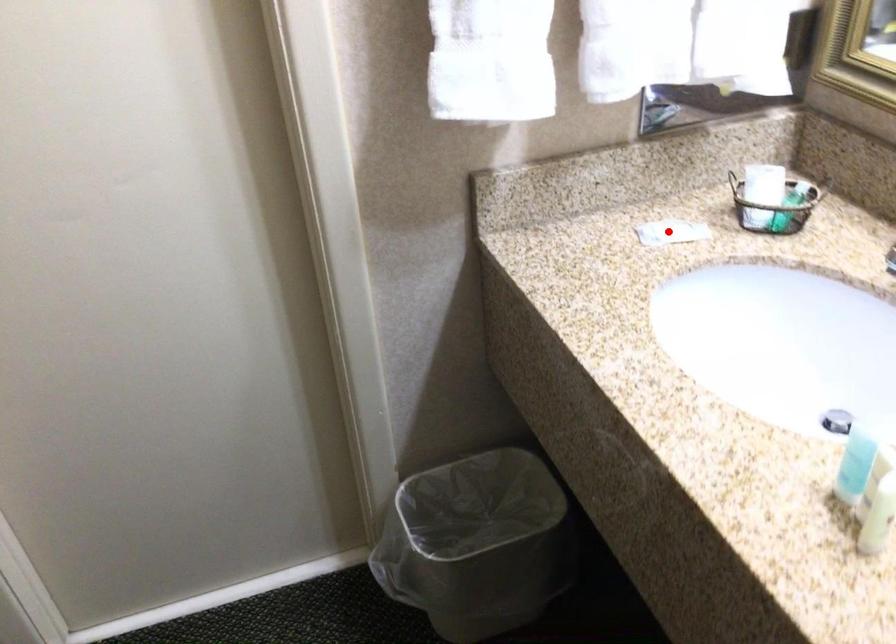
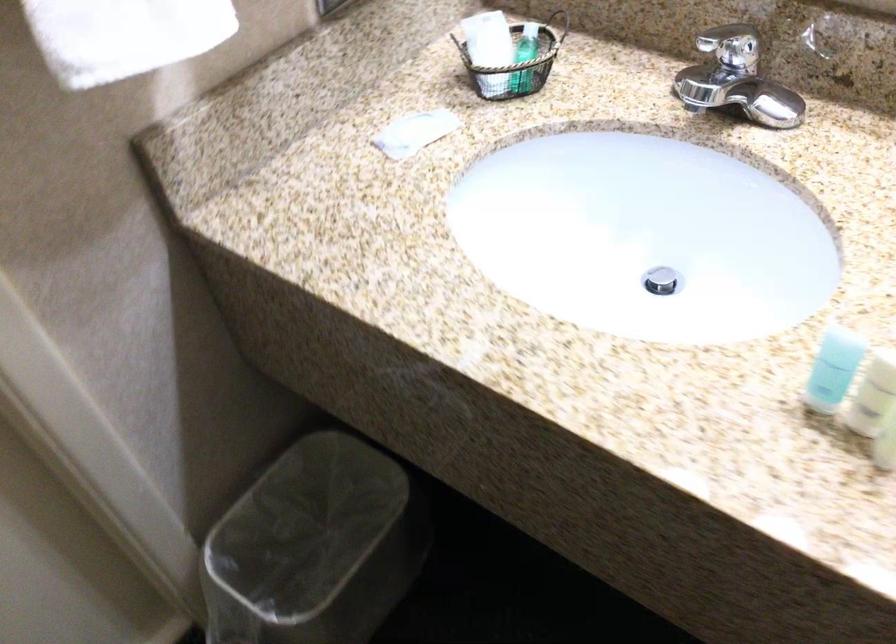
Locate, in the second image, the point that corresponds to the highlighted location in the first image.

(414, 131)